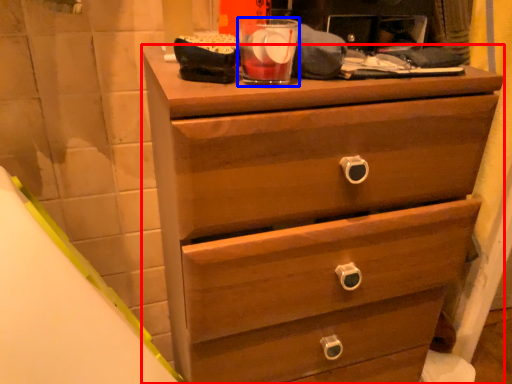
Question: Which of the following is the farthest to the observer, chest of drawers (highlighted by a red box) or beverage (highlighted by a blue box)?

Choices:
 (A) chest of drawers
 (B) beverage

Answer: (B)